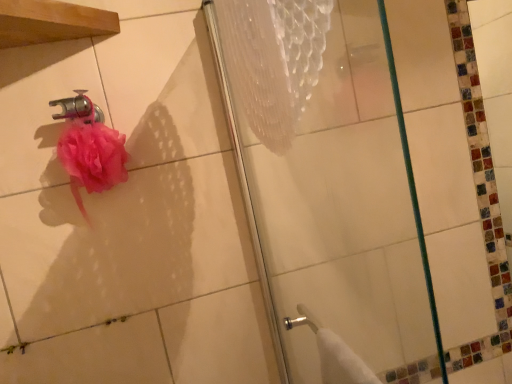
Question: Is pink fluffy sponge at upper left inside the boundaries of polished chrome faucet at upper left, or outside?

Choices:
 (A) outside
 (B) inside

Answer: (A)

Question: From a real-world perspective, is pink fluffy sponge at upper left physically located above or below polished chrome faucet at upper left?

Choices:
 (A) above
 (B) below

Answer: (B)

Question: Which object is positioned farthest from the transparent glass shower door at center?

Choices:
 (A) polished chrome faucet at upper left
 (B) pink fluffy sponge at upper left

Answer: (A)

Question: Which of these objects is positioned farthest from the pink fluffy sponge at upper left?

Choices:
 (A) polished chrome faucet at upper left
 (B) transparent glass shower door at center

Answer: (B)